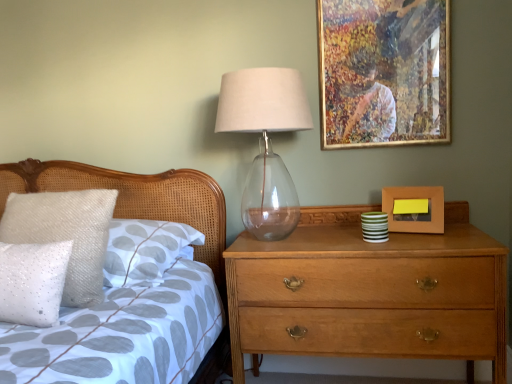
Locate an element on the screen. This screenshot has width=512, height=384. white sequined pillow at left, which is the 1th pillow in front-to-back order is located at coordinates (33, 282).

Image resolution: width=512 pixels, height=384 pixels. Identify the location of white sequined pillow at left, which is the first pillow from back to front. (66, 234).

I want to click on transparent glass table lamp at upper center, so click(266, 143).

Where is `wooden picture frame at right, arranged as the 2th picture frame when viewed from the top`? This screenshot has height=384, width=512. wooden picture frame at right, arranged as the 2th picture frame when viewed from the top is located at coordinates (415, 210).

Would you say white sequined pillow at left, the second pillow from the back, is to the left or to the right of light brown wooden chest of drawers at right in the picture?

white sequined pillow at left, the second pillow from the back, is to the left of light brown wooden chest of drawers at right.

In terms of size, does white sequined pillow at left, the second pillow from the back, appear bigger or smaller than light brown wooden chest of drawers at right?

white sequined pillow at left, the second pillow from the back, is smaller than light brown wooden chest of drawers at right.

I want to click on chest of drawers behind the white sequined pillow at left, the second pillow from the back, so click(369, 292).

Are white sequined pillow at left, which is the 1th pillow in front-to-back order, and light brown wooden chest of drawers at right far apart?

They are positioned close to each other.

Does point (416, 81) appear closer or farther from the camera than point (24, 241)?

Point (416, 81).

Could you measure the distance between gold-framed artwork at upper right, arranged as the 1th picture frame when viewed from the top, and white sequined pillow at left, which is the first pillow from back to front?

gold-framed artwork at upper right, arranged as the 1th picture frame when viewed from the top, and white sequined pillow at left, which is the first pillow from back to front, are 3.89 feet apart from each other.

The height and width of the screenshot is (384, 512). There is a white sequined pillow at left, which is the first pillow from back to front. Identify the location of the 2nd picture frame above it (from the image's perspective). (384, 72).

Is gold-framed artwork at upper right, arranged as the 1th picture frame when viewed from the top, far from transparent glass table lamp at upper center?

No, gold-framed artwork at upper right, arranged as the 1th picture frame when viewed from the top, is not far away from transparent glass table lamp at upper center.

Which object is positioned more to the right, gold-framed artwork at upper right, which ranks as the 2th picture frame in bottom-to-top order, or transparent glass table lamp at upper center?

gold-framed artwork at upper right, which ranks as the 2th picture frame in bottom-to-top order, is more to the right.

Is gold-framed artwork at upper right, arranged as the 1th picture frame when viewed from the top, in front of or behind transparent glass table lamp at upper center in the image?

Clearly, gold-framed artwork at upper right, arranged as the 1th picture frame when viewed from the top, is behind transparent glass table lamp at upper center.

In the scene shown: From a real-world perspective, who is located lower, gold-framed artwork at upper right, arranged as the 1th picture frame when viewed from the top, or transparent glass table lamp at upper center?

From a 3D spatial view, transparent glass table lamp at upper center is below.

Is transparent glass table lamp at upper center oriented away from white sequined pillow at left, the second pillow from the back?

transparent glass table lamp at upper center is not turned away from white sequined pillow at left, the second pillow from the back.

In the scene shown: Who is smaller, transparent glass table lamp at upper center or white sequined pillow at left, which is the 1th pillow in front-to-back order?

With smaller size is white sequined pillow at left, which is the 1th pillow in front-to-back order.

From the image's perspective, is transparent glass table lamp at upper center under white sequined pillow at left, which is the 1th pillow in front-to-back order?

Incorrect, from the image's perspective, transparent glass table lamp at upper center is higher than white sequined pillow at left, which is the 1th pillow in front-to-back order.

Does transparent glass table lamp at upper center contain white sequined pillow at left, which is the 1th pillow in front-to-back order?

That's incorrect, white sequined pillow at left, which is the 1th pillow in front-to-back order, is not inside transparent glass table lamp at upper center.

In the image, is light brown wooden chest of drawers at right positioned in front of or behind transparent glass table lamp at upper center?

In the image, light brown wooden chest of drawers at right appears in front of transparent glass table lamp at upper center.

Does point (361, 325) lie in front of point (268, 104)?

No.

The image size is (512, 384). Find the location of `chest of drawers below the transparent glass table lamp at upper center (from the image's perspective)`. chest of drawers below the transparent glass table lamp at upper center (from the image's perspective) is located at coordinates (369, 292).

From a real-world perspective, between wooden picture frame at right, arranged as the 2th picture frame when viewed from the top, and light brown wooden chest of drawers at right, who is vertically lower?

light brown wooden chest of drawers at right is physically lower.

How different are the orientations of wooden picture frame at right, which is the 1th picture frame in bottom-to-top order, and light brown wooden chest of drawers at right in degrees?

They differ by 15.4 degrees in their facing directions.

From the light brown wooden chest of drawers at right, count 2nd picture frame to the right and point to it. Please provide its 2D coordinates.

[(415, 210)]

Is wooden picture frame at right, arranged as the 2th picture frame when viewed from the top, at the right side of light brown wooden chest of drawers at right?

Yes, wooden picture frame at right, arranged as the 2th picture frame when viewed from the top, is to the right of light brown wooden chest of drawers at right.

Identify the location of table lamp directly beneath the gold-framed artwork at upper right, arranged as the 1th picture frame when viewed from the top (from a real-world perspective). (266, 143).

Would you say transparent glass table lamp at upper center is outside gold-framed artwork at upper right, arranged as the 1th picture frame when viewed from the top?

Absolutely, transparent glass table lamp at upper center is external to gold-framed artwork at upper right, arranged as the 1th picture frame when viewed from the top.

Is transparent glass table lamp at upper center far away from gold-framed artwork at upper right, which ranks as the 2th picture frame in bottom-to-top order?

That's not correct — transparent glass table lamp at upper center is a little close to gold-framed artwork at upper right, which ranks as the 2th picture frame in bottom-to-top order.

Does transparent glass table lamp at upper center have a lesser width compared to gold-framed artwork at upper right, which ranks as the 2th picture frame in bottom-to-top order?

No.

You are a GUI agent. You are given a task and a screenshot of the screen. Output one action in this format:
    pyautogui.click(x=<x>, y=<y>)
    Task: Click on the chest of drawers below the white sequined pillow at left, the second pillow from the back (from the image's perspective)
    The width and height of the screenshot is (512, 384).
    Given the screenshot: What is the action you would take?
    pyautogui.click(x=369, y=292)

From the gold-framed artwork at upper right, arranged as the 1th picture frame when viewed from the top, count 1st pillows forward and point to it. Please provide its 2D coordinates.

[(66, 234)]

Looking at the image, which one is located closer to white sequined pillow at left, which is the 2th pillow from front to back, wooden picture frame at right, which is the 1th picture frame in bottom-to-top order, or gold-framed artwork at upper right, arranged as the 1th picture frame when viewed from the top?

gold-framed artwork at upper right, arranged as the 1th picture frame when viewed from the top, is positioned closer to the anchor white sequined pillow at left, which is the 2th pillow from front to back.

Which object lies nearer to the anchor point wooden picture frame at right, which is the 1th picture frame in bottom-to-top order, gold-framed artwork at upper right, arranged as the 1th picture frame when viewed from the top, or white sequined pillow at left, the second pillow from the back?

Among the two, gold-framed artwork at upper right, arranged as the 1th picture frame when viewed from the top, is located nearer to wooden picture frame at right, which is the 1th picture frame in bottom-to-top order.

Considering their positions, is wooden picture frame at right, arranged as the 2th picture frame when viewed from the top, positioned further to white sequined pillow at left, which is the 1th pillow in front-to-back order, than white sequined pillow at left, which is the 2th pillow from front to back?

wooden picture frame at right, arranged as the 2th picture frame when viewed from the top, is positioned further to the anchor white sequined pillow at left, which is the 1th pillow in front-to-back order.

Looking at this image, looking at the image, which one is located further to white sequined pillow at left, the second pillow from the back, light brown wooden chest of drawers at right or transparent glass table lamp at upper center?

Based on the image, light brown wooden chest of drawers at right appears to be further to white sequined pillow at left, the second pillow from the back.

When comparing their distances from gold-framed artwork at upper right, which ranks as the 2th picture frame in bottom-to-top order, does wooden picture frame at right, which is the 1th picture frame in bottom-to-top order, or transparent glass table lamp at upper center seem closer?

wooden picture frame at right, which is the 1th picture frame in bottom-to-top order, lies closer to gold-framed artwork at upper right, which ranks as the 2th picture frame in bottom-to-top order, than the other object.

Looking at the image, which one is located further to white sequined pillow at left, which is the first pillow from back to front, light brown wooden chest of drawers at right or transparent glass table lamp at upper center?

light brown wooden chest of drawers at right is positioned further to the anchor white sequined pillow at left, which is the first pillow from back to front.

From the picture: Looking at the image, which one is located further to white sequined pillow at left, which is the first pillow from back to front, gold-framed artwork at upper right, which ranks as the 2th picture frame in bottom-to-top order, or light brown wooden chest of drawers at right?

Among the two, gold-framed artwork at upper right, which ranks as the 2th picture frame in bottom-to-top order, is located further to white sequined pillow at left, which is the first pillow from back to front.

Based on their spatial positions, is light brown wooden chest of drawers at right or gold-framed artwork at upper right, arranged as the 1th picture frame when viewed from the top, further from wooden picture frame at right, arranged as the 2th picture frame when viewed from the top?

Among the two, gold-framed artwork at upper right, arranged as the 1th picture frame when viewed from the top, is located further to wooden picture frame at right, arranged as the 2th picture frame when viewed from the top.

You are a GUI agent. You are given a task and a screenshot of the screen. Output one action in this format:
    pyautogui.click(x=<x>, y=<y>)
    Task: Click on the pillow located between white sequined pillow at left, the second pillow from the back, and wooden picture frame at right, which is the 1th picture frame in bottom-to-top order, in the left-right direction
    The height and width of the screenshot is (384, 512).
    Given the screenshot: What is the action you would take?
    pyautogui.click(x=66, y=234)

What are the coordinates of `table lamp between white sequined pillow at left, which is the first pillow from back to front, and light brown wooden chest of drawers at right, in the horizontal direction` in the screenshot? It's located at (266, 143).

I want to click on table lamp situated between white sequined pillow at left, the second pillow from the back, and gold-framed artwork at upper right, arranged as the 1th picture frame when viewed from the top, from left to right, so click(x=266, y=143).

Image resolution: width=512 pixels, height=384 pixels. I want to click on picture frame between gold-framed artwork at upper right, arranged as the 1th picture frame when viewed from the top, and light brown wooden chest of drawers at right in the up-down direction, so click(x=415, y=210).